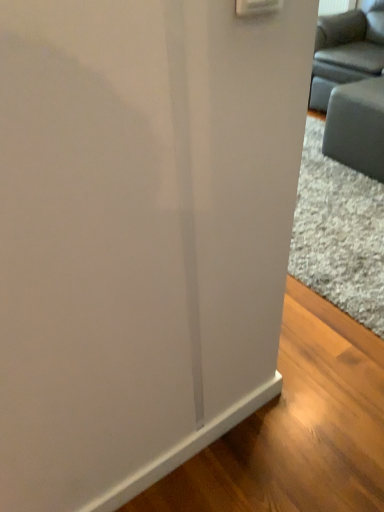
The image size is (384, 512). What are the coordinates of `gray fabric couch at right` in the screenshot? It's located at (357, 126).

This screenshot has height=512, width=384. Describe the element at coordinates (357, 126) in the screenshot. I see `gray fabric couch at right` at that location.

The height and width of the screenshot is (512, 384). I want to click on matte gray couch at upper right, so click(346, 51).

What do you see at coordinates (346, 51) in the screenshot?
I see `matte gray couch at upper right` at bounding box center [346, 51].

The height and width of the screenshot is (512, 384). In order to click on gray fabric couch at right in this screenshot , I will do `click(357, 126)`.

Can you confirm if gray fabric couch at right is positioned to the right of matte gray couch at upper right?

In fact, gray fabric couch at right is to the left of matte gray couch at upper right.

Is gray fabric couch at right further to the viewer compared to matte gray couch at upper right?

No, the depth of gray fabric couch at right is less than that of matte gray couch at upper right.

Considering the positions of points (383, 145) and (363, 32), is point (383, 145) closer to camera compared to point (363, 32)?

That is True.

From the image's perspective, is gray fabric couch at right above or below matte gray couch at upper right?

Clearly, from the image's perspective, gray fabric couch at right is below matte gray couch at upper right.

From a real-world perspective, who is located lower, gray fabric couch at right or matte gray couch at upper right?

gray fabric couch at right, from a real-world perspective.

Consider the image. Which object is wider, gray fabric couch at right or matte gray couch at upper right?

matte gray couch at upper right.

Which of these two, gray fabric couch at right or matte gray couch at upper right, stands shorter?

gray fabric couch at right.

Based on their sizes in the image, would you say gray fabric couch at right is bigger or smaller than matte gray couch at upper right?

In the image, gray fabric couch at right appears to be smaller than matte gray couch at upper right.

Is gray fabric couch at right inside the boundaries of matte gray couch at upper right, or outside?

gray fabric couch at right lies outside matte gray couch at upper right.

Is gray fabric couch at right far away from matte gray couch at upper right?

gray fabric couch at right is actually quite close to matte gray couch at upper right.

Is gray fabric couch at right oriented towards matte gray couch at upper right?

No, gray fabric couch at right is not facing towards matte gray couch at upper right.

Find the location of a particular element. The height and width of the screenshot is (512, 384). furniture beneath the matte gray couch at upper right (from a real-world perspective) is located at coordinates (357, 126).

Is matte gray couch at upper right at the right side of gray fabric couch at right?

Yes.

Which object is further away from the camera, matte gray couch at upper right or gray fabric couch at right?

matte gray couch at upper right is further away from the camera.

Which point is more distant from viewer, (355, 42) or (361, 132)?

Positioned behind is point (355, 42).

From the image's perspective, is matte gray couch at upper right above gray fabric couch at right?

Yes, from the image's perspective, matte gray couch at upper right is over gray fabric couch at right.

From a real-world perspective, relative to gray fabric couch at right, is matte gray couch at upper right vertically above or below?

From a real-world perspective, matte gray couch at upper right is physically above gray fabric couch at right.

Considering the sizes of matte gray couch at upper right and gray fabric couch at right in the image, is matte gray couch at upper right wider or thinner than gray fabric couch at right?

matte gray couch at upper right is wider than gray fabric couch at right.

Is matte gray couch at upper right shorter than gray fabric couch at right?

Incorrect, the height of matte gray couch at upper right does not fall short of that of gray fabric couch at right.

Looking at this image, considering the relative sizes of matte gray couch at upper right and gray fabric couch at right in the image provided, is matte gray couch at upper right smaller than gray fabric couch at right?

Incorrect, matte gray couch at upper right is not smaller in size than gray fabric couch at right.

In the scene shown: Is gray fabric couch at right inside matte gray couch at upper right?

No, gray fabric couch at right is located outside of matte gray couch at upper right.

Is matte gray couch at upper right not close to gray fabric couch at right?

No, matte gray couch at upper right is in close proximity to gray fabric couch at right.

Is matte gray couch at upper right oriented towards gray fabric couch at right?

No, matte gray couch at upper right is not oriented towards gray fabric couch at right.

What's the angular difference between matte gray couch at upper right and gray fabric couch at right's facing directions?

3.13 degrees separate the facing orientations of matte gray couch at upper right and gray fabric couch at right.

Locate an element on the screen. The width and height of the screenshot is (384, 512). furniture on the left of matte gray couch at upper right is located at coordinates (357, 126).

This screenshot has height=512, width=384. What are the coordinates of `studio couch lying behind the gray fabric couch at right` in the screenshot? It's located at coord(346,51).

The width and height of the screenshot is (384, 512). What are the coordinates of `furniture beneath the matte gray couch at upper right (from a real-world perspective)` in the screenshot? It's located at (357, 126).